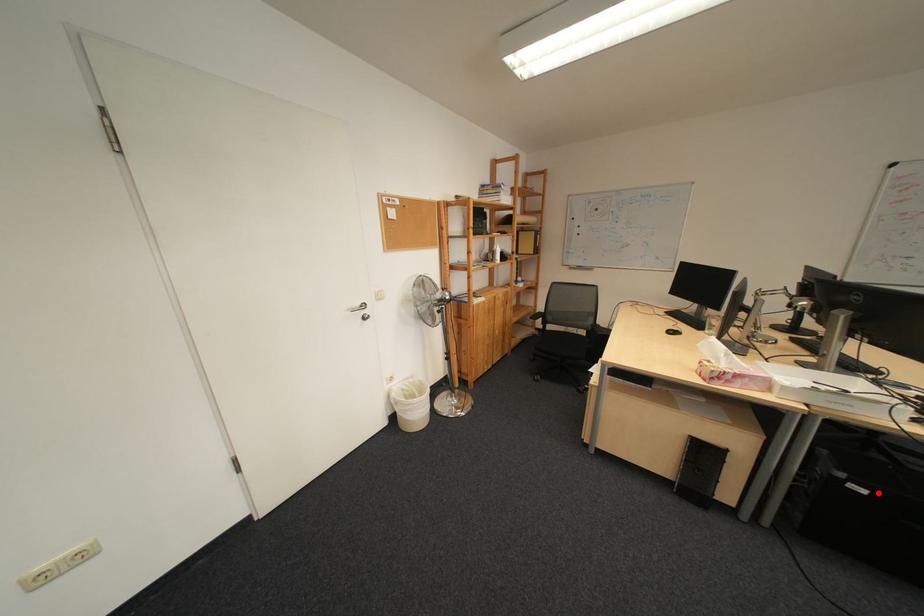
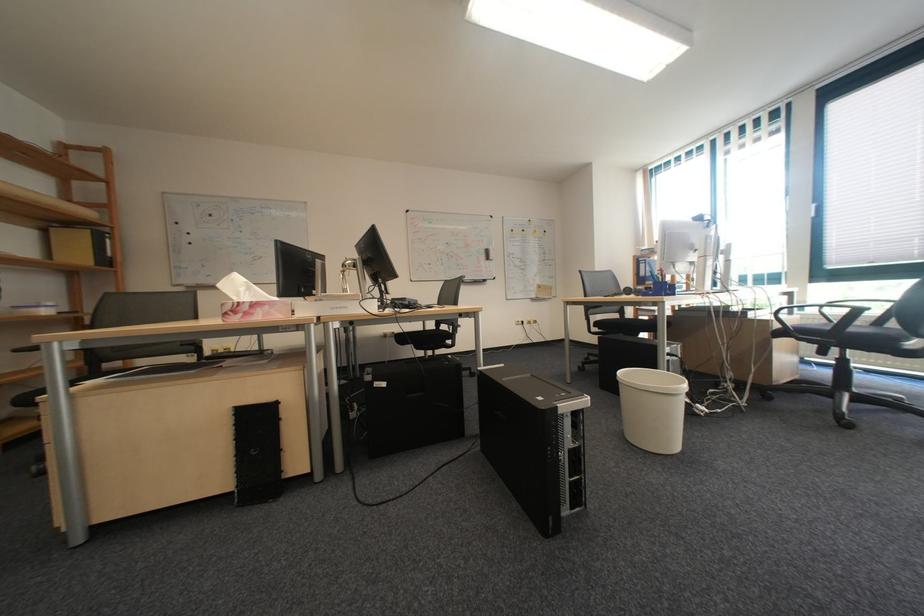
Question: I am providing you with two images of the same scene from different viewpoints. In image1, a red point is highlighted. Considering the same 3D point in image2, which of the following is correct?

Choices:
 (A) It is closer
 (B) It is farther

Answer: (B)